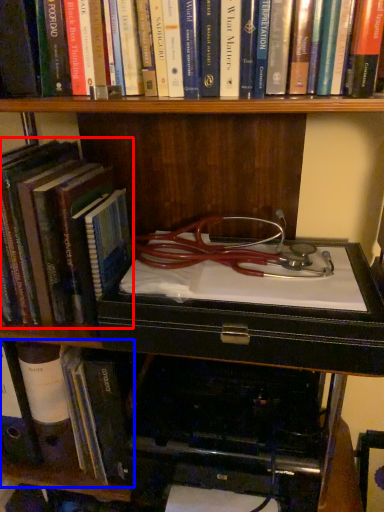
Question: Among these objects, which one is farthest to the camera, book (highlighted by a red box) or book (highlighted by a blue box)?

Choices:
 (A) book
 (B) book

Answer: (B)